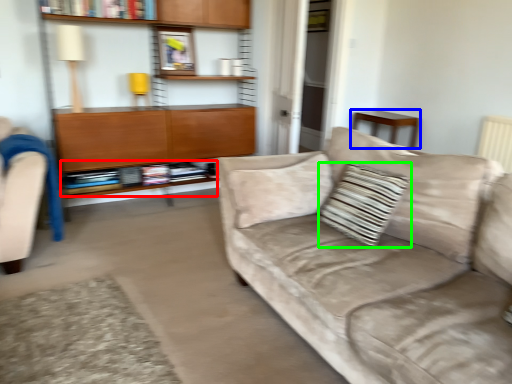
Question: Considering the real-world distances, which object is closest to book (highlighted by a red box)? table (highlighted by a blue box) or throw pillow (highlighted by a green box).

Choices:
 (A) table
 (B) throw pillow

Answer: (B)